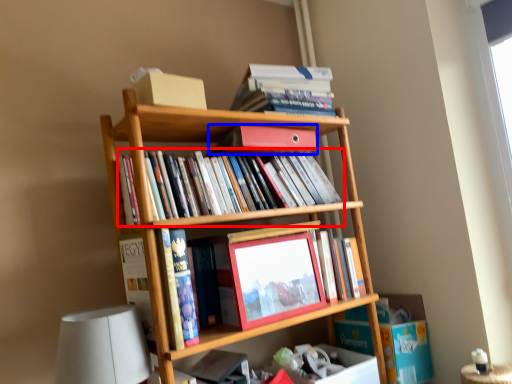
Question: Which of the following is the farthest to the observer, book (highlighted by a red box) or book (highlighted by a blue box)?

Choices:
 (A) book
 (B) book

Answer: (B)